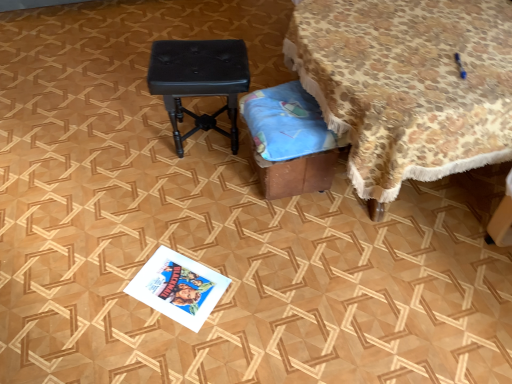
This screenshot has height=384, width=512. Find the location of `vacant space in white glossy magazine at lower center (from a real-world perspective)`. vacant space in white glossy magazine at lower center (from a real-world perspective) is located at coordinates (176, 286).